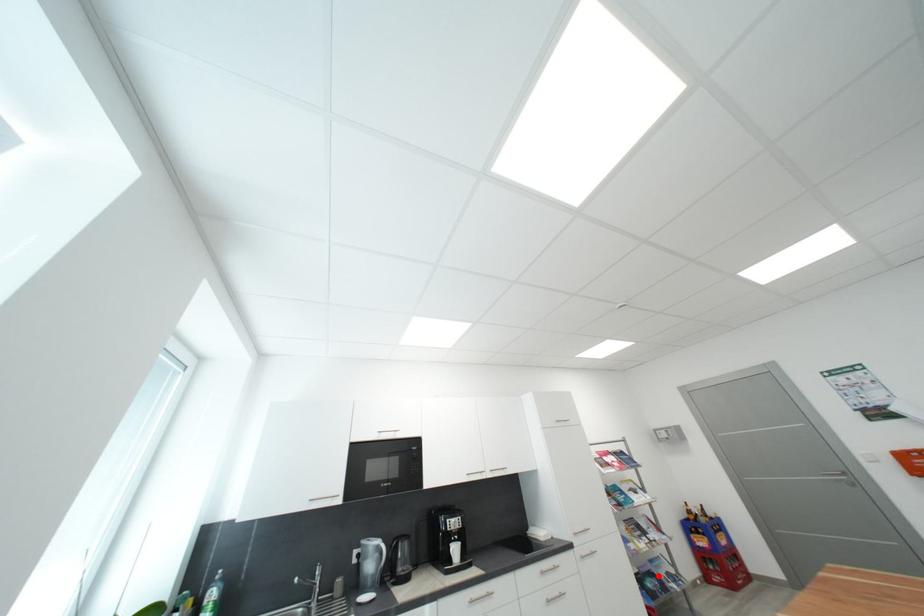
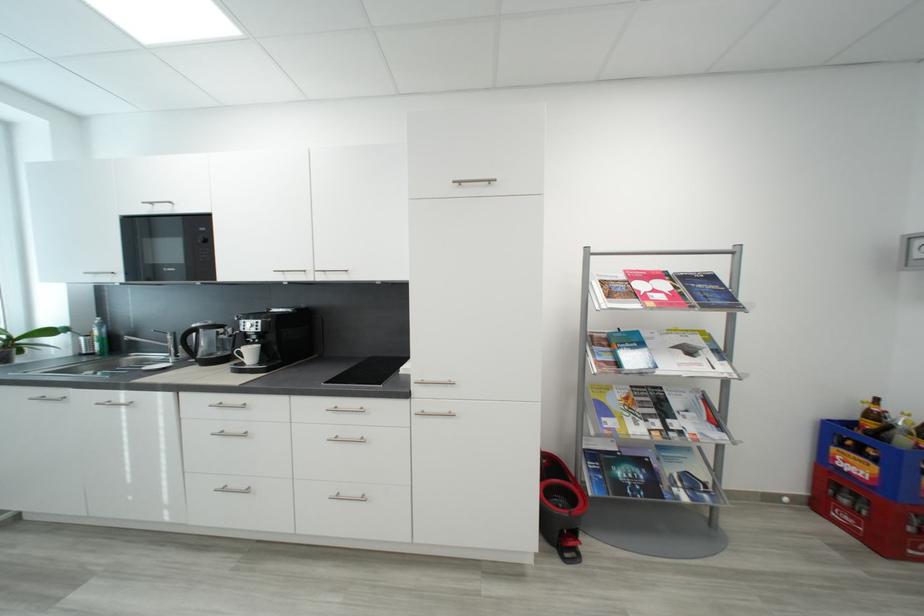
In the second image, find the point that corresponds to the highlighted location in the first image.

(650, 464)